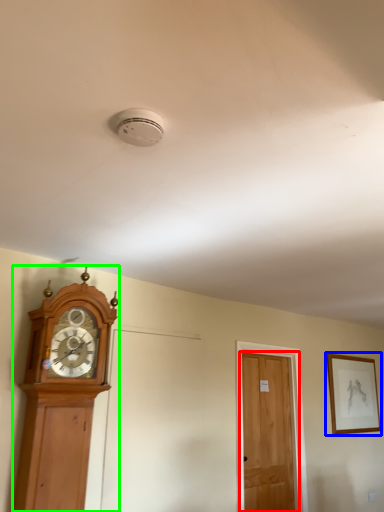
Question: Which object is the farthest from door (highlighted by a red box)? Choose among these: picture frame (highlighted by a blue box) or wall clock (highlighted by a green box).

Choices:
 (A) picture frame
 (B) wall clock

Answer: (B)